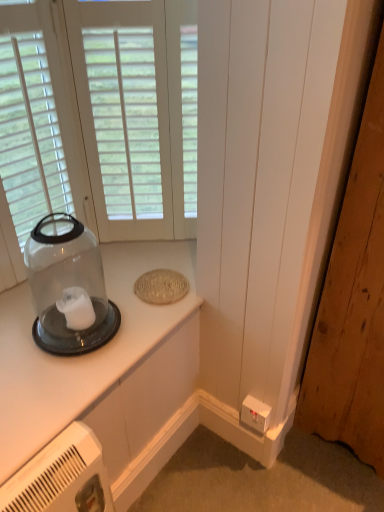
Describe the element at coordinates (80, 356) in the screenshot. I see `clear glass jar at upper left` at that location.

Identify the location of transparent glass jar at left. The height and width of the screenshot is (512, 384). (68, 287).

Measure the distance between point (x=94, y=304) and camera.

The depth of point (x=94, y=304) is 1.24 meters.

This screenshot has width=384, height=512. Describe the element at coordinates (97, 120) in the screenshot. I see `white wood window at upper left` at that location.

What do you see at coordinates (256, 414) in the screenshot? The height and width of the screenshot is (512, 384). I see `white plastic electric outlet at lower right` at bounding box center [256, 414].

What do you see at coordinates (353, 304) in the screenshot? The width and height of the screenshot is (384, 512). I see `wooden door at lower right` at bounding box center [353, 304].

Identify the location of clear glass jar at upper left. This screenshot has width=384, height=512. (80, 356).

Is clear glass jar at upper left facing away from wooden door at lower right?

clear glass jar at upper left is not turned away from wooden door at lower right.

Identify the location of door to the right of clear glass jar at upper left. This screenshot has width=384, height=512. (353, 304).

In terms of height, does clear glass jar at upper left look taller or shorter compared to wooden door at lower right?

Considering their sizes, clear glass jar at upper left has less height than wooden door at lower right.

Is clear glass jar at upper left further to the viewer compared to wooden door at lower right?

Yes, the depth of clear glass jar at upper left is greater than that of wooden door at lower right.

Looking at their sizes, would you say clear glass jar at upper left is wider or thinner than transparent glass jar at left?

Clearly, clear glass jar at upper left has more width compared to transparent glass jar at left.

Is clear glass jar at upper left inside the boundaries of transparent glass jar at left, or outside?

clear glass jar at upper left is outside transparent glass jar at left.

Considering the sizes of objects clear glass jar at upper left and transparent glass jar at left in the image provided, who is smaller, clear glass jar at upper left or transparent glass jar at left?

clear glass jar at upper left is smaller.

Considering the sizes of objects transparent glass jar at left and wooden door at lower right in the image provided, who is thinner, transparent glass jar at left or wooden door at lower right?

Thinner between the two is transparent glass jar at left.

Are transparent glass jar at left and wooden door at lower right located far from each other?

Actually, transparent glass jar at left and wooden door at lower right are a little close together.

From a real-world perspective, is transparent glass jar at left located higher than wooden door at lower right?

Yes, from a real-world perspective, transparent glass jar at left is on top of wooden door at lower right.

From the image's perspective, would you say transparent glass jar at left is shown under wooden door at lower right?

Yes.

Considering the relative positions of white wood window at upper left and white plastic electric outlet at lower right in the image provided, is white wood window at upper left to the right of white plastic electric outlet at lower right from the viewer's perspective?

Incorrect, white wood window at upper left is not on the right side of white plastic electric outlet at lower right.

Is white wood window at upper left not within white plastic electric outlet at lower right?

Indeed, white wood window at upper left is completely outside white plastic electric outlet at lower right.

From the image's perspective, is white wood window at upper left positioned above or below white plastic electric outlet at lower right?

white wood window at upper left is situated higher than white plastic electric outlet at lower right in the image.

Considering the sizes of objects white wood window at upper left and white plastic electric outlet at lower right in the image provided, who is smaller, white wood window at upper left or white plastic electric outlet at lower right?

Smaller between the two is white plastic electric outlet at lower right.

Does point (264, 423) come closer to viewer compared to point (367, 219)?

That is False.

From a real-world perspective, which is physically below, white plastic electric outlet at lower right or wooden door at lower right?

white plastic electric outlet at lower right, from a real-world perspective.

Would you say white plastic electric outlet at lower right is a long distance from wooden door at lower right?

No, white plastic electric outlet at lower right is not far from wooden door at lower right.

Looking at this image, from the image's perspective, does white plastic electric outlet at lower right appear lower than wooden door at lower right?

Yes.

Would you consider white wood window at upper left to be distant from clear glass jar at upper left?

They are positioned close to each other.

Locate an element on the screen. The height and width of the screenshot is (512, 384). countertop in front of the white wood window at upper left is located at coordinates (80, 356).

From the image's perspective, between white wood window at upper left and clear glass jar at upper left, who is located below?

clear glass jar at upper left, from the image's perspective.

Which is farther from the camera, (39, 46) or (110, 286)?

The point (110, 286) is more distant.

Which is behind, point (346, 360) or point (45, 302)?

The point (346, 360) is more distant.

Which object is positioned more to the left, wooden door at lower right or transparent glass jar at left?

transparent glass jar at left is more to the left.

From the image's perspective, is wooden door at lower right beneath transparent glass jar at left?

No.

Is wooden door at lower right thinner than transparent glass jar at left?

No, wooden door at lower right is not thinner than transparent glass jar at left.

Where is `countertop directly beneath the wooden door at lower right (from a real-world perspective)`? Image resolution: width=384 pixels, height=512 pixels. countertop directly beneath the wooden door at lower right (from a real-world perspective) is located at coordinates (80, 356).

Find the location of a particular element. This screenshot has width=384, height=512. appliance located above the clear glass jar at upper left (from a real-world perspective) is located at coordinates (68, 287).

Considering their positions, is transparent glass jar at left positioned further to clear glass jar at upper left than wooden door at lower right?

wooden door at lower right lies further to clear glass jar at upper left than the other object.

Considering their positions, is white wood window at upper left positioned closer to wooden door at lower right than white plastic electric outlet at lower right?

The object closer to wooden door at lower right is white plastic electric outlet at lower right.

Which object lies further to the anchor point wooden door at lower right, transparent glass jar at left or white wood window at upper left?

The object further to wooden door at lower right is white wood window at upper left.

Looking at the image, which one is located further to white wood window at upper left, clear glass jar at upper left or wooden door at lower right?

wooden door at lower right lies further to white wood window at upper left than the other object.

Looking at the image, which one is located further to white plastic electric outlet at lower right, wooden door at lower right or transparent glass jar at left?

Based on the image, transparent glass jar at left appears to be further to white plastic electric outlet at lower right.

Estimate the real-world distances between objects in this image. Which object is further from transparent glass jar at left, clear glass jar at upper left or white wood window at upper left?

white wood window at upper left is further to transparent glass jar at left.

Looking at the image, which one is located further to white plastic electric outlet at lower right, transparent glass jar at left or clear glass jar at upper left?

Among the two, transparent glass jar at left is located further to white plastic electric outlet at lower right.

From the image, which object appears to be nearer to clear glass jar at upper left, white plastic electric outlet at lower right or wooden door at lower right?

white plastic electric outlet at lower right is positioned closer to the anchor clear glass jar at upper left.

Where is `window between transparent glass jar at left and wooden door at lower right in the horizontal direction`? The image size is (384, 512). window between transparent glass jar at left and wooden door at lower right in the horizontal direction is located at coordinates (97, 120).

The image size is (384, 512). Identify the location of electric outlet between white wood window at upper left and wooden door at lower right in the horizontal direction. (256, 414).

Where is `countertop between transparent glass jar at left and white plastic electric outlet at lower right from left to right`? countertop between transparent glass jar at left and white plastic electric outlet at lower right from left to right is located at coordinates (80, 356).

This screenshot has width=384, height=512. Identify the location of electric outlet between transparent glass jar at left and wooden door at lower right. (256, 414).